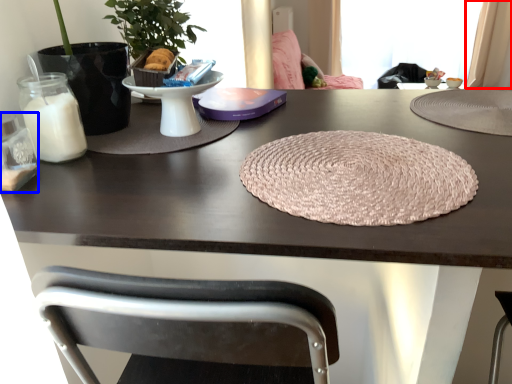
Question: Which object appears farthest to the camera in this image, curtain (highlighted by a red box) or candle holder (highlighted by a blue box)?

Choices:
 (A) curtain
 (B) candle holder

Answer: (A)